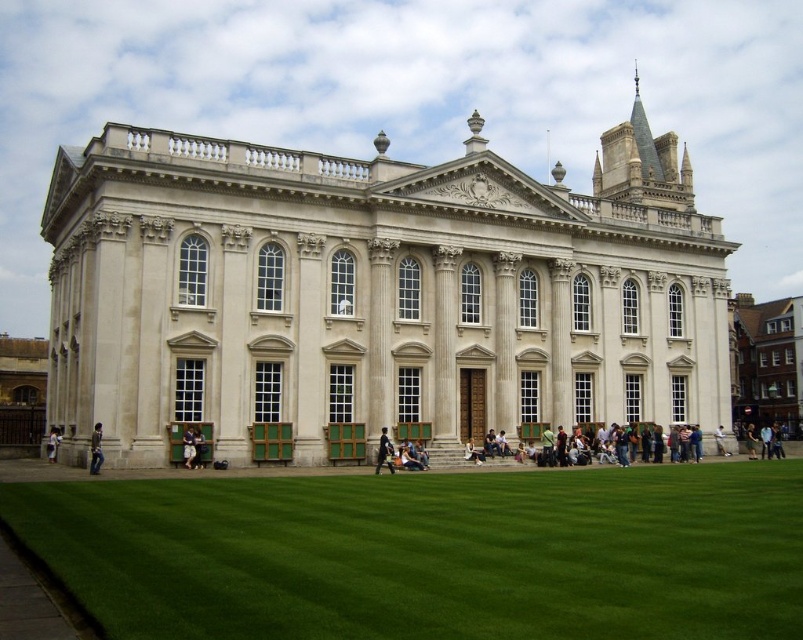
Consider the image. You are standing in front of the classical building and notice two points marked on the facade. The first point is at coordinate point [190,444] and the second is at point [722,432]. Which point is closer to your eyes?

Point [190,444] is closer to the camera than point [722,432], so the first point is closer to your eyes.

Consider the image. You are standing in front of the classical building and see the light brown leather jacket at lower center and the light brown wooden bench at center. Which object is closer to you?

The light brown leather jacket at lower center is closer to you because it is in front of the light brown wooden bench at center.